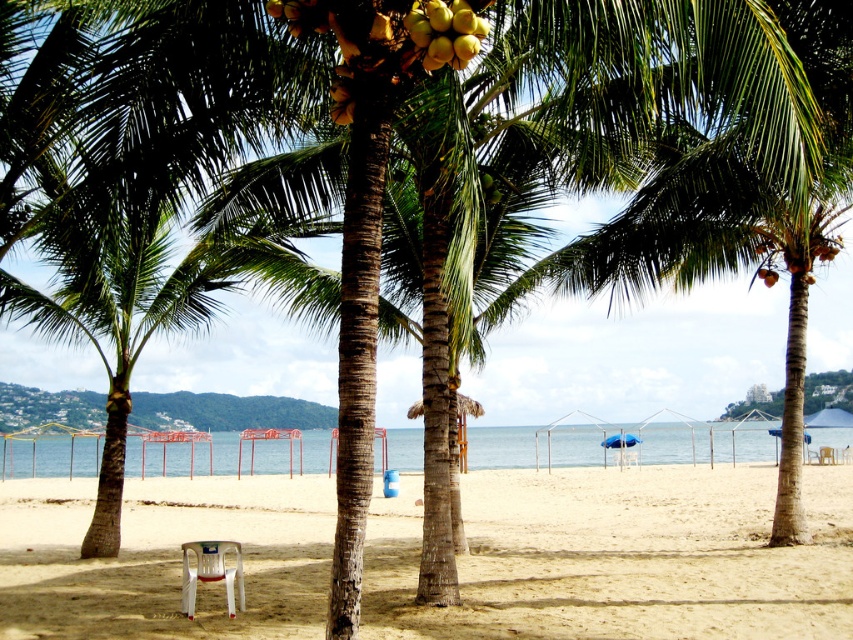
Question: Can you confirm if sandy beige at center is wider than yellow matte coconut at upper center?

Choices:
 (A) yes
 (B) no

Answer: (A)

Question: Does sandy beige at center have a lesser width compared to white plastic chair at lower left?

Choices:
 (A) yes
 (B) no

Answer: (B)

Question: Is yellow matte coconut at upper center positioned in front of white plastic beach chair at center?

Choices:
 (A) no
 (B) yes

Answer: (B)

Question: Among these objects, which one is farthest from the camera?

Choices:
 (A) yellow matte coconut at upper center
 (B) sandy beige at center

Answer: (B)

Question: Which point is closer to the camera?

Choices:
 (A) yellow matte coconut at upper center
 (B) sandy beige at center
 (C) white plastic beach chair at center
 (D) white plastic chair at lower left

Answer: (A)

Question: Based on their relative distances, which object is farther from the white plastic beach chair at center?

Choices:
 (A) yellow matte coconut at upper center
 (B) white plastic chair at lower left
 (C) sandy beige at center

Answer: (A)